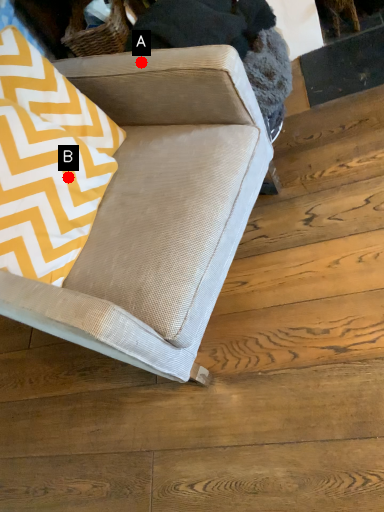
Question: Two points are circled on the image, labeled by A and B beside each circle. Which point appears farthest from the camera in this image?

Choices:
 (A) A is further
 (B) B is further

Answer: (A)